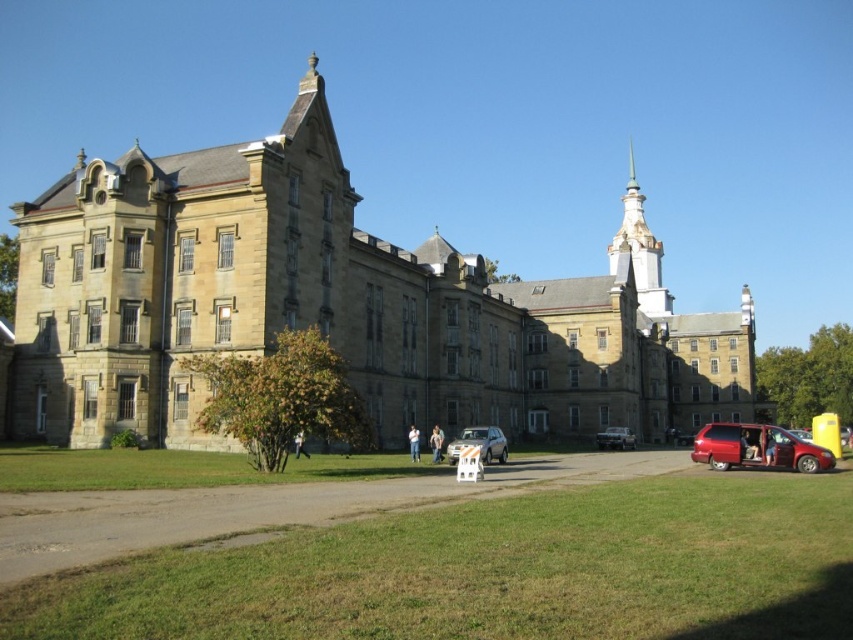
Question: Which point is closer to the camera?

Choices:
 (A) light blue jeans at center
 (B) green grass at lower center

Answer: (B)

Question: Does matte silver sedan at center appear on the right side of white cotton shirt at center?

Choices:
 (A) yes
 (B) no

Answer: (A)

Question: Which is farther from the shiny red minivan at lower right?

Choices:
 (A) light blue jeans at center
 (B) white cotton shirt at center
 (C) silver metallic sedan at center
 (D) light brown leather jacket at center

Answer: (D)

Question: Does matte silver sedan at center appear under white cotton shirt at center?

Choices:
 (A) yes
 (B) no

Answer: (A)

Question: Which object appears closest to the camera in this image?

Choices:
 (A) light blue jeans at center
 (B) matte silver sedan at center
 (C) green grass at lower center
 (D) shiny red minivan at lower right

Answer: (C)

Question: Does silver metallic sedan at center appear on the right side of light brown leather jacket at center?

Choices:
 (A) no
 (B) yes

Answer: (B)